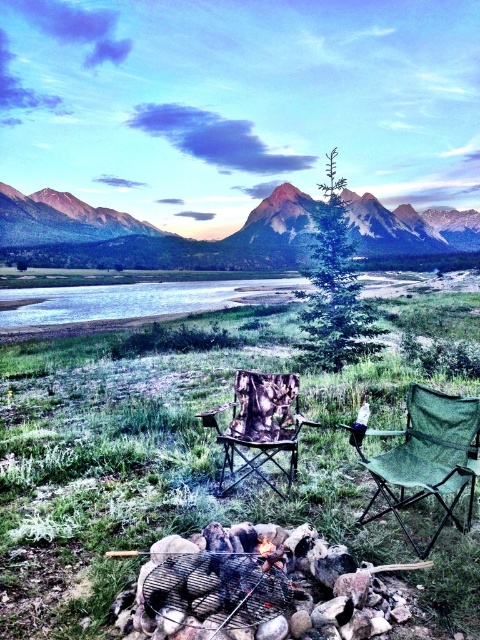
Question: Among these points, which one is nearest to the camera?

Choices:
 (A) (428, 426)
 (B) (412, 209)
 (C) (219, 480)

Answer: (A)

Question: Can you confirm if green fabric folding chair at center is positioned below camo fabric chair at center?

Choices:
 (A) yes
 (B) no

Answer: (B)

Question: Which point is farther to the camera?

Choices:
 (A) (454, 483)
 (B) (448, 252)

Answer: (B)

Question: Can you confirm if rugged granite mountain at upper center is positioned above camo fabric chair at center?

Choices:
 (A) no
 (B) yes

Answer: (B)

Question: Is rugged granite mountain at upper center closer to the viewer compared to camo fabric chair at center?

Choices:
 (A) yes
 (B) no

Answer: (B)

Question: Estimate the real-world distances between objects in this image. Which object is closer to the green fabric folding chair at center?

Choices:
 (A) camo fabric chair at center
 (B) rugged granite mountain at upper center

Answer: (A)